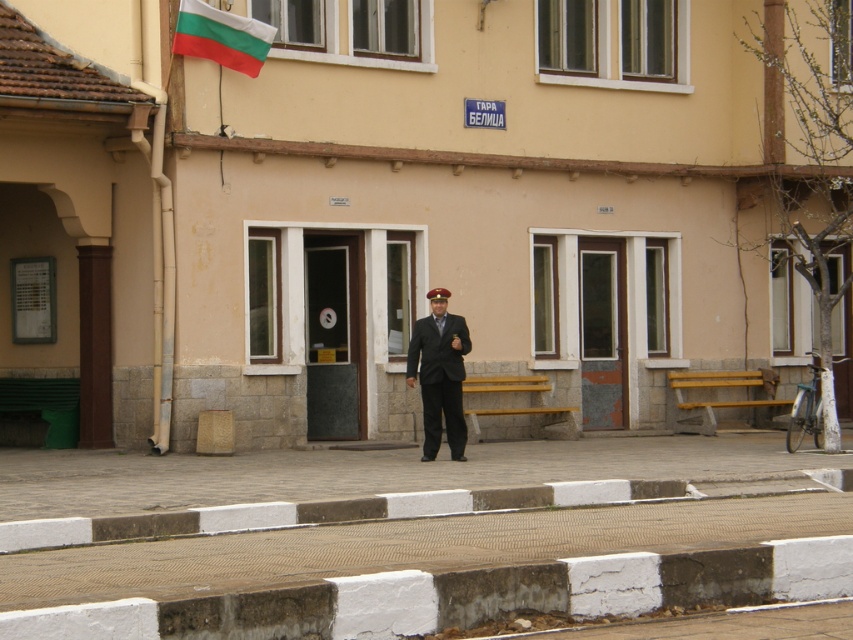
Who is more forward, (425, 323) or (248, 20)?

Point (425, 323)

Describe the element at coordinates (439, 372) in the screenshot. I see `dark suit at center` at that location.

The height and width of the screenshot is (640, 853). I want to click on dark suit at center, so click(x=439, y=372).